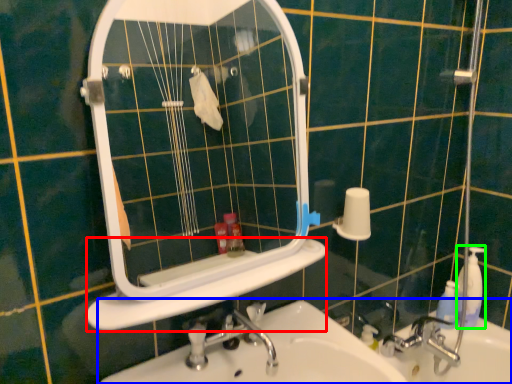
Question: Based on their relative distances, which object is farther from ledge (highlighted by a red box)? Choose from sink (highlighted by a blue box) and soap dispenser (highlighted by a green box).

Choices:
 (A) sink
 (B) soap dispenser

Answer: (B)